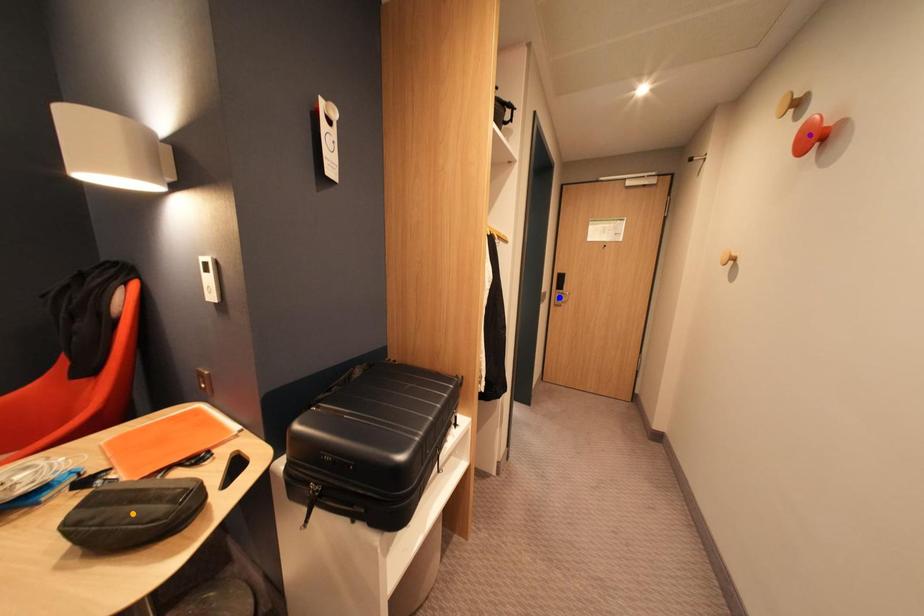
Order these from nearest to farthest:
A) purple point
B) orange point
C) blue point

1. orange point
2. purple point
3. blue point